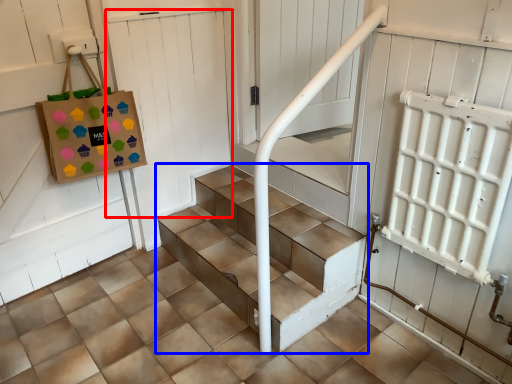
Question: Which object is closer to the camera taking this photo, door (highlighted by a red box) or stairs (highlighted by a blue box)?

Choices:
 (A) door
 (B) stairs

Answer: (B)